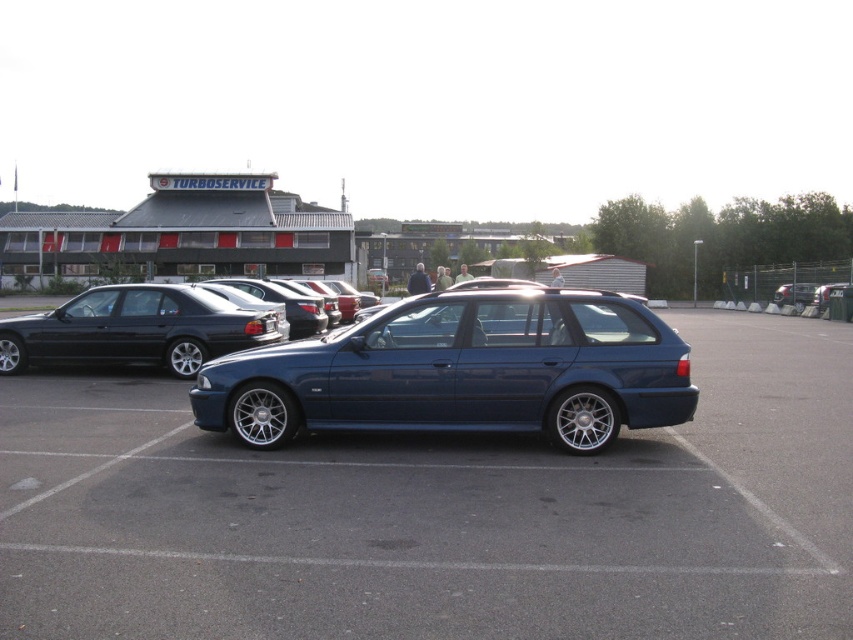
Is metallic blue car at center taller than black plastic license plate at center?

Yes, metallic blue car at center is taller than black plastic license plate at center.

The width and height of the screenshot is (853, 640). I want to click on metallic blue car at center, so click(x=439, y=513).

Based on the photo, is metallic blue wagon at center to the left of glossy metallic car at center from the viewer's perspective?

Yes, metallic blue wagon at center is to the left of glossy metallic car at center.

Does metallic blue wagon at center lie behind glossy metallic car at center?

No.

Describe the element at coordinates (462, 371) in the screenshot. I see `metallic blue wagon at center` at that location.

The width and height of the screenshot is (853, 640). Identify the location of metallic blue wagon at center. (462, 371).

Between metallic blue car at center and glossy metallic car at center, which one appears on the left side from the viewer's perspective?

metallic blue car at center is more to the left.

The image size is (853, 640). In order to click on metallic blue car at center in this screenshot , I will do `click(439, 513)`.